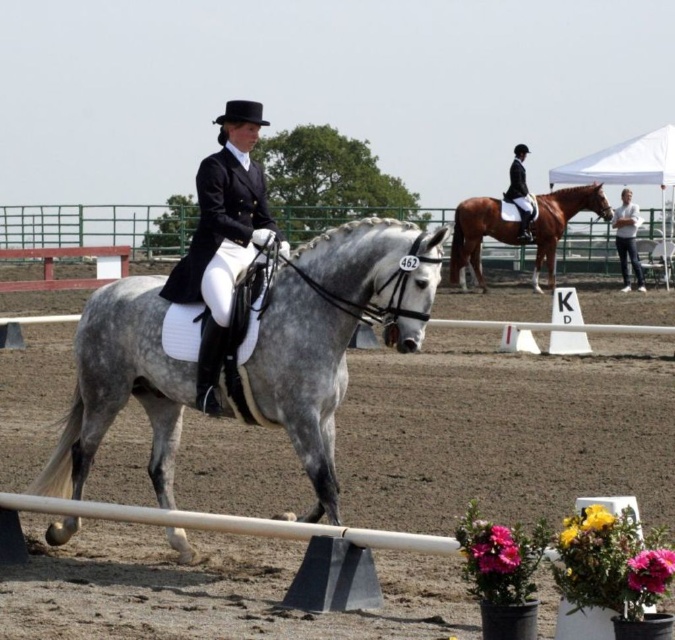
You are a spectator at the dressage competition. You notice the black satin riding jacket at center and the shiny brown horse at upper right. Which object has a smaller width?

The black satin riding jacket at center has a smaller width than the shiny brown horse at upper right.

You are a spectator at the dressage competition. You notice the black satin riding jacket at center and the shiny brown horse at upper right. Which object is shorter in height?

The black satin riding jacket at center has a lesser height compared to the shiny brown horse at upper right, so the black satin riding jacket at center is shorter.

You are a judge at the dressage competition. You need to determine which horse has a smaller body size between the gray glossy horse at center and the shiny brown horse at upper right. Which one should you choose?

The gray glossy horse at center is thinner than the shiny brown horse at upper right, so the gray glossy horse at center has a smaller body size.